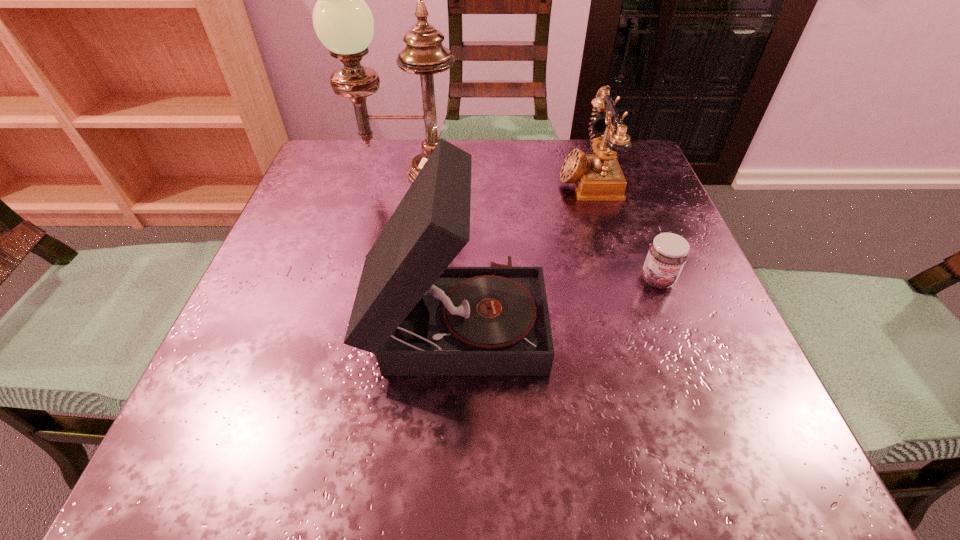
This screenshot has width=960, height=540. I want to click on oil lamp, so click(342, 20).

Where is `phonograph_record`? Image resolution: width=960 pixels, height=540 pixels. phonograph_record is located at coordinates (420, 317).

The height and width of the screenshot is (540, 960). Identify the location of the second shortest object. (598, 177).

I want to click on jam, so click(667, 254).

I want to click on vacant area situated 0.060m on the left of the oil lamp, so click(x=323, y=174).

Image resolution: width=960 pixels, height=540 pixels. I want to click on vacant area situated 0.260m on the front-facing side of the third shortest object, so click(x=711, y=318).

I want to click on vacant space situated 0.290m on the dial number of the second shortest object, so click(423, 177).

Where is `blank space located on the dial number of the second shortest object`? blank space located on the dial number of the second shortest object is located at coordinates (507, 177).

Image resolution: width=960 pixels, height=540 pixels. What are the coordinates of `vacant space located 0.270m on the dial number of the second shortest object` in the screenshot? It's located at (433, 177).

Find the location of `vacant space positioned on the front label of the shortest object`. vacant space positioned on the front label of the shortest object is located at coordinates (708, 413).